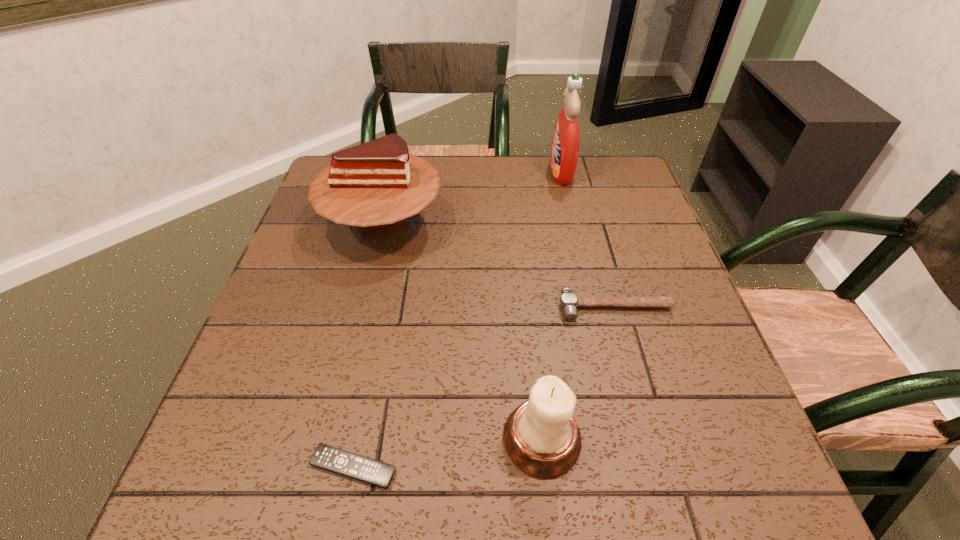
The image size is (960, 540). Find the location of `free spot that satisfies the following two spatial constraints: 1. on the front side of the second tallest object; 2. on the right side of the third object from left to right`. free spot that satisfies the following two spatial constraints: 1. on the front side of the second tallest object; 2. on the right side of the third object from left to right is located at coordinates (331, 439).